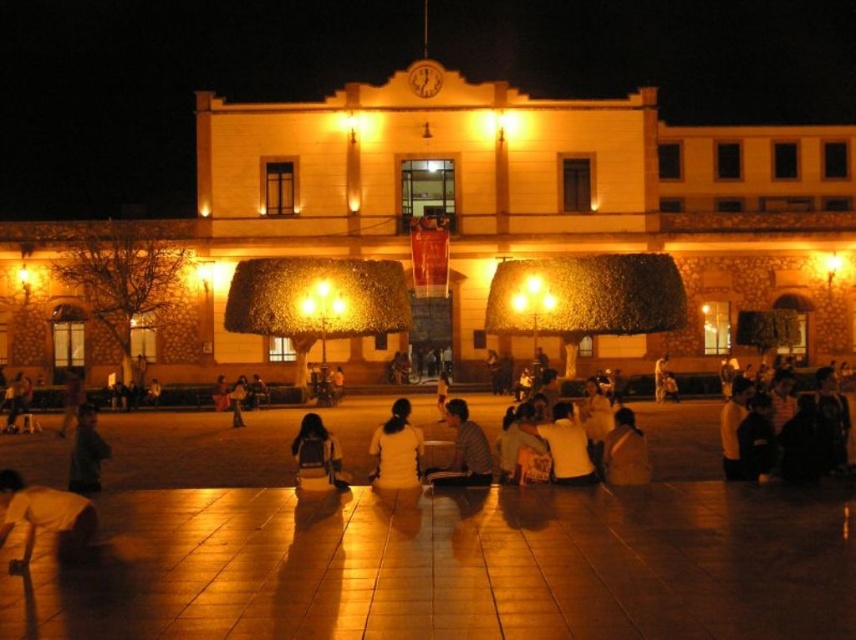
You are a photographer positioned at the entrance of the building. You want to capture a photo that includes both the white shirt at center and the light brown leather jacket at lower right. Based on their positions, which one should you adjust your camera to focus on first to ensure both are in frame?

Since the white shirt at center is positioned on the left side of the light brown leather jacket at lower right, you should focus on the light brown leather jacket at lower right first to ensure the white shirt at center is also captured in the frame.

You are a photographer trying to capture a group photo of the people in the plaza. You notice the white shirt at center and the light brown leather jacket at lower right. Which person should you focus on to ensure they are fully visible in the frame without cropping?

The white shirt at center has a larger width than the light brown leather jacket at lower right, so focusing on the white shirt at center ensures it will fit without cropping, accommodating the other person as well.